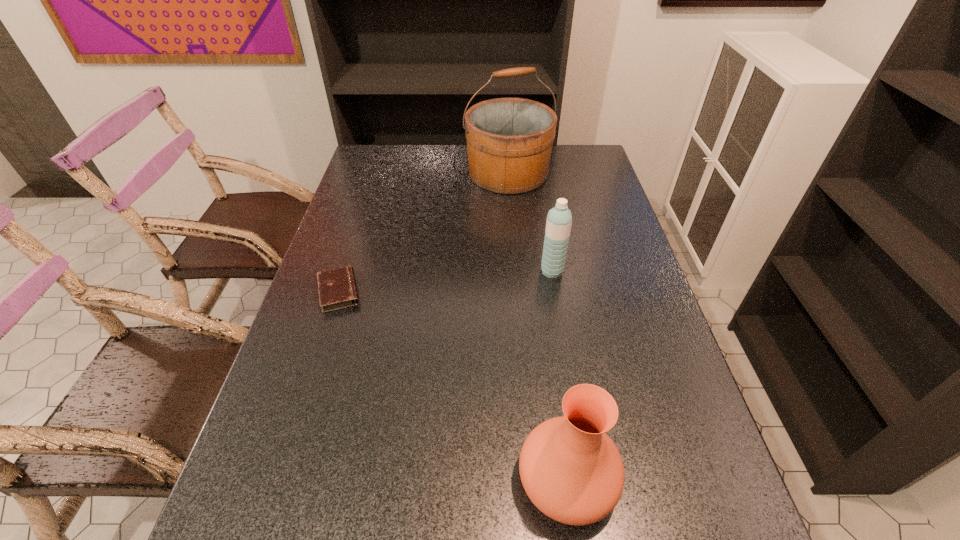
Where is `object located in the far edge section of the desktop`? object located in the far edge section of the desktop is located at coordinates (509, 140).

This screenshot has height=540, width=960. What are the coordinates of `object located in the left edge section of the desktop` in the screenshot? It's located at (337, 288).

This screenshot has height=540, width=960. I want to click on vacant space at the far edge of the desktop, so click(x=432, y=146).

In the image, there is a desktop. Find the location of `vacant space at the left edge`. vacant space at the left edge is located at coordinates (311, 288).

This screenshot has width=960, height=540. I want to click on vacant region at the right edge of the desktop, so click(637, 263).

Where is `vacant space at the far left corner`? This screenshot has width=960, height=540. vacant space at the far left corner is located at coordinates (386, 157).

This screenshot has height=540, width=960. I want to click on free space at the far right corner of the desktop, so click(573, 146).

Where is `free area in between the bucket and the water bottle`? This screenshot has height=540, width=960. free area in between the bucket and the water bottle is located at coordinates (530, 222).

At what (x,y) coordinates should I click in order to perform the action: click on unoccupied area between the nearest object and the tallest object. Please return your answer as a coordinate pair (x, y). This screenshot has width=960, height=540. Looking at the image, I should click on (538, 327).

This screenshot has width=960, height=540. In order to click on vacant point located between the leftmost object and the water bottle in this screenshot , I will do `click(445, 281)`.